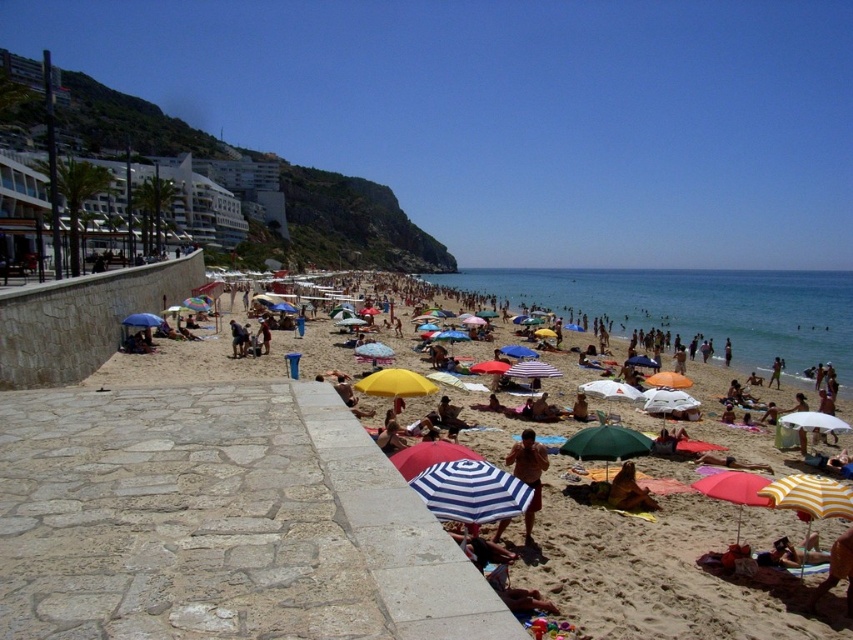
Question: Does blue and white striped umbrella at lower center have a larger size compared to red fabric umbrella at lower right?

Choices:
 (A) yes
 (B) no

Answer: (A)

Question: Does tan skin person at center appear under brown fur dog at lower right?

Choices:
 (A) no
 (B) yes

Answer: (A)

Question: Based on their relative distances, which object is farther from the blue and white striped umbrella at lower center?

Choices:
 (A) green fabric umbrella at center
 (B) red fabric umbrella at lower right
 (C) brown fur dog at lower right

Answer: (B)

Question: Which object is closer to the camera taking this photo?

Choices:
 (A) red fabric umbrella at lower right
 (B) beach umbrella at center
 (C) green fabric umbrella at center

Answer: (B)

Question: Does green fabric umbrella at center appear on the right side of red fabric umbrella at lower right?

Choices:
 (A) no
 (B) yes

Answer: (A)

Question: Which point is farther to the camera?

Choices:
 (A) (247, 344)
 (B) (643, 493)
 (C) (741, 483)
 (D) (669, 516)

Answer: (A)